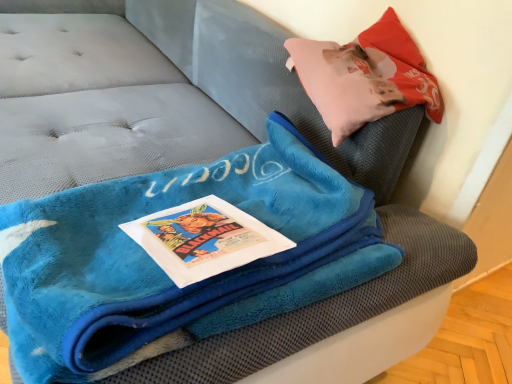
You are a GUI agent. You are given a task and a screenshot of the screen. Output one action in this format:
    pyautogui.click(x=<x>, y=<y>)
    Task: Click on the velvet pink pillow at upper right
    The width and height of the screenshot is (512, 384).
    Given the screenshot: What is the action you would take?
    pyautogui.click(x=365, y=76)

This screenshot has height=384, width=512. What do you see at coordinates (365, 76) in the screenshot?
I see `velvet pink pillow at upper right` at bounding box center [365, 76].

The width and height of the screenshot is (512, 384). Find the location of `velvet pink pillow at upper right`. velvet pink pillow at upper right is located at coordinates (365, 76).